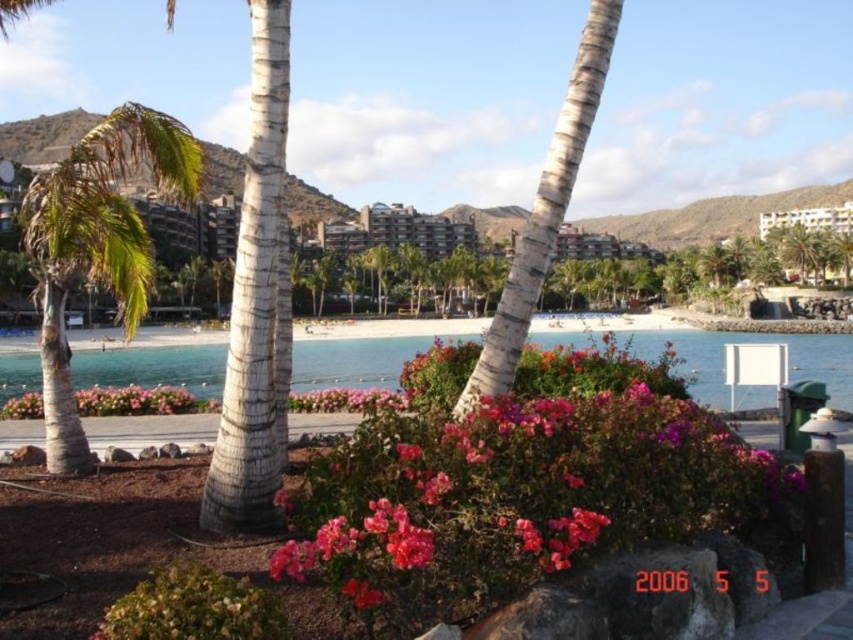
You are a photographer wanting to capture the pink matte flowers at center without the green leafy palm tree at center blocking them. Is there a way to adjust your position to achieve this?

The green leafy palm tree at center is positioned over the pink matte flowers at center, so moving to a lower angle or position behind the flowers might allow you to capture them without the palm tree blocking the view.

You are a photographer planning to capture a sunset shot at this coastal location. You want to ensure the green leafy palm tree at center and pink matte flowers at center are both visible in the frame. Based on their positions, which object should you place closer to the left side of your camera viewfinder?

The green leafy palm tree at center is positioned on the left side of pink matte flowers at center, so to capture both in the frame, you should place the green leafy palm tree at center closer to the left side of your camera viewfinder.